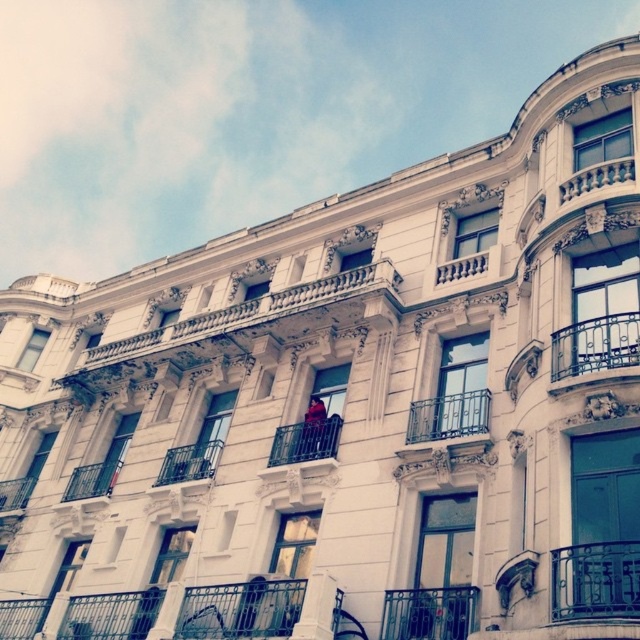
Between wrought iron balcony at center and red velvet jacket at center, which one has more height?

wrought iron balcony at center is taller.

Who is lower down, wrought iron balcony at center or red velvet jacket at center?

red velvet jacket at center is lower down.

This screenshot has width=640, height=640. Identify the location of wrought iron balcony at center. (449, 422).

Between point (205, 342) and point (164, 456), which one is positioned in front?

Point (164, 456) is in front.

The image size is (640, 640). What are the coordinates of `white stone balcony at center` in the screenshot? It's located at (237, 326).

Identify the location of white stone balcony at center. This screenshot has width=640, height=640. (237, 326).

Locate an element on the screen. This screenshot has height=640, width=640. dark gray wrought iron balcony at upper right is located at coordinates (595, 352).

Which is below, dark gray wrought iron balcony at upper right or metallic railing at center?

metallic railing at center

You are a GUI agent. You are given a task and a screenshot of the screen. Output one action in this format:
    pyautogui.click(x=<x>, y=<y>)
    Task: Click on the dark gray wrought iron balcony at upper right
    Image resolution: width=640 pixels, height=640 pixels.
    Given the screenshot: What is the action you would take?
    pyautogui.click(x=595, y=352)